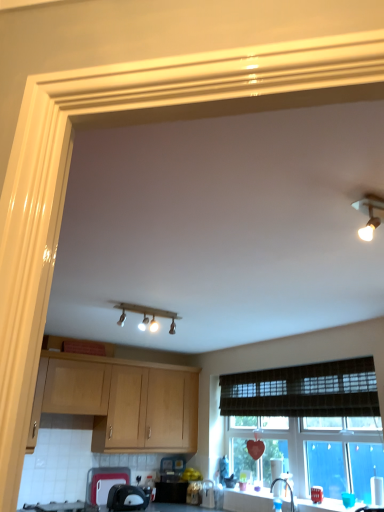
Image resolution: width=384 pixels, height=512 pixels. I want to click on matte plastic cutting board at lower left, acting as the fourth appliance starting from the right, so click(104, 482).

Find the location of a particular element. metallic silver toaster at lower center, which is the first appliance in right-to-left order is located at coordinates (208, 494).

Measure the distance between light wood cabinet at upper left and metallic silver toaster at lower center, the 3th appliance viewed from the left.

They are 38.47 inches apart.

Which of these two, light wood cabinet at upper left or metallic silver toaster at lower center, which is the 2th appliance from right to left, stands shorter?

metallic silver toaster at lower center, which is the 2th appliance from right to left.

Is light wood cabinet at upper left bigger than metallic silver toaster at lower center, the 3th appliance viewed from the left?

Yes.

Looking at their sizes, would you say light wood cabinet at upper left is wider or thinner than metallic silver toaster at lower center, which is the 2th appliance from right to left?

Clearly, light wood cabinet at upper left has more width compared to metallic silver toaster at lower center, which is the 2th appliance from right to left.

Which object is positioned more to the left, matte plastic cutting board at lower left, which is the first appliance from left to right, or matte wood light fixture at upper center?

From the viewer's perspective, matte plastic cutting board at lower left, which is the first appliance from left to right, appears more on the left side.

Which is farther, (93, 495) or (128, 305)?

Point (93, 495)

Considering the sizes of objects matte plastic cutting board at lower left, which is the first appliance from left to right, and matte wood light fixture at upper center in the image provided, who is thinner, matte plastic cutting board at lower left, which is the first appliance from left to right, or matte wood light fixture at upper center?

Thinner between the two is matte plastic cutting board at lower left, which is the first appliance from left to right.

Is matte plastic cutting board at lower left, acting as the fourth appliance starting from the right, not inside matte wood light fixture at upper center?

Yes, matte plastic cutting board at lower left, acting as the fourth appliance starting from the right, is located beyond the bounds of matte wood light fixture at upper center.

How many degrees apart are the facing directions of matte plastic cutting board at lower left, which is the first appliance from left to right, and metallic silver toaster at lower center, the 3th appliance viewed from the left?

85.5 degrees.

Identify the location of the 2nd appliance to the right when counting from the matte plastic cutting board at lower left, acting as the fourth appliance starting from the right. The image size is (384, 512). (194, 493).

Is matte plastic cutting board at lower left, which is the first appliance from left to right, facing towards metallic silver toaster at lower center, which is the 2th appliance from right to left?

No, matte plastic cutting board at lower left, which is the first appliance from left to right, does not turn towards metallic silver toaster at lower center, which is the 2th appliance from right to left.

Is metallic silver toaster at lower center, the 3th appliance viewed from the left, wider than matte wood light fixture at upper center?

No, metallic silver toaster at lower center, the 3th appliance viewed from the left, is not wider than matte wood light fixture at upper center.

Is metallic silver toaster at lower center, which is the 2th appliance from right to left, positioned beyond the bounds of matte wood light fixture at upper center?

Indeed, metallic silver toaster at lower center, which is the 2th appliance from right to left, is completely outside matte wood light fixture at upper center.

Is metallic silver toaster at lower center, which is the 2th appliance from right to left, far away from matte wood light fixture at upper center?

Indeed, metallic silver toaster at lower center, which is the 2th appliance from right to left, is not near matte wood light fixture at upper center.

In terms of height, does metallic silver toaster at lower center, which is the 2th appliance from right to left, look taller or shorter compared to matte wood light fixture at upper center?

Considering their sizes, metallic silver toaster at lower center, which is the 2th appliance from right to left, has more height than matte wood light fixture at upper center.

Considering the points (196, 492) and (265, 494), which point is behind, point (196, 492) or point (265, 494)?

The point (196, 492) is farther.

From the image's perspective, who appears lower, metallic silver toaster at lower center, the 3th appliance viewed from the left, or white glossy countertop at lower center?

metallic silver toaster at lower center, the 3th appliance viewed from the left, appears lower in the image.

Is metallic silver toaster at lower center, which is the 2th appliance from right to left, not near white glossy countertop at lower center?

metallic silver toaster at lower center, which is the 2th appliance from right to left, is near white glossy countertop at lower center, not far away.

Is white glossy countertop at lower center at the back of metallic silver toaster at lower center, the 3th appliance viewed from the left?

No, white glossy countertop at lower center is not at the back of metallic silver toaster at lower center, the 3th appliance viewed from the left.

How much distance is there between satin chrome faucet at lower center and matte wood light fixture at upper center?

satin chrome faucet at lower center is 1.80 meters from matte wood light fixture at upper center.

Do you think satin chrome faucet at lower center is within matte wood light fixture at upper center, or outside of it?

satin chrome faucet at lower center is spatially situated outside matte wood light fixture at upper center.

Is satin chrome faucet at lower center positioned with its back to matte wood light fixture at upper center?

That's not correct — satin chrome faucet at lower center is not looking away from matte wood light fixture at upper center.

Is metallic silver toaster at lower center, which is the 2th appliance from right to left, in front of or behind light wood cabinet at upper left in the image?

metallic silver toaster at lower center, which is the 2th appliance from right to left, is positioned farther from the viewer than light wood cabinet at upper left.

Can you tell me how much metallic silver toaster at lower center, the 3th appliance viewed from the left, and light wood cabinet at upper left differ in facing direction?

metallic silver toaster at lower center, the 3th appliance viewed from the left, and light wood cabinet at upper left are facing 87.8 degrees away from each other.

Which object is wider, metallic silver toaster at lower center, the 3th appliance viewed from the left, or light wood cabinet at upper left?

light wood cabinet at upper left is wider.

The width and height of the screenshot is (384, 512). I want to click on the 4th appliance behind the light wood cabinet at upper left, counting from the anchor's position, so click(194, 493).

Image resolution: width=384 pixels, height=512 pixels. I want to click on cabinetry in front of the metallic silver toaster at lower center, the 3th appliance viewed from the left, so click(x=120, y=402).

Find the location of a particular element. Image resolution: width=384 pixels, height=512 pixels. the 2nd appliance below the matte wood light fixture at upper center (from the image's perspective) is located at coordinates (104, 482).

Looking at the image, which one is located closer to black plastic toaster at lower center, the second appliance in the left-to-right sequence, black glass gas stove at lower left or metallic silver toaster at lower center, the 3th appliance viewed from the left?

Based on the image, black glass gas stove at lower left appears to be nearer to black plastic toaster at lower center, the second appliance in the left-to-right sequence.

Based on the photo, estimate the real-world distances between objects in this image. Which object is further from black glass gas stove at lower left, metallic silver toaster at lower center, the 3th appliance viewed from the left, or matte wood light fixture at upper center?

Based on the image, matte wood light fixture at upper center appears to be further to black glass gas stove at lower left.

Estimate the real-world distances between objects in this image. Which object is closer to metallic silver toaster at lower center, which is the first appliance in right-to-left order, white glossy countertop at lower center or light wood cabinet at upper left?

white glossy countertop at lower center is positioned closer to the anchor metallic silver toaster at lower center, which is the first appliance in right-to-left order.

Which object lies further to the anchor point satin chrome faucet at lower center, brown woven curtain at lower center or black plastic toaster at lower center, which is counted as the third appliance, starting from the right?

black plastic toaster at lower center, which is counted as the third appliance, starting from the right, is further to satin chrome faucet at lower center.

From the image, which object appears to be nearer to matte plastic cutting board at lower left, acting as the fourth appliance starting from the right, white glossy countertop at lower center or black glass gas stove at lower left?

Among the two, black glass gas stove at lower left is located nearer to matte plastic cutting board at lower left, acting as the fourth appliance starting from the right.

Based on their spatial positions, is light wood cabinet at upper left or matte plastic cutting board at lower left, acting as the fourth appliance starting from the right, further from brown woven curtain at lower center?

matte plastic cutting board at lower left, acting as the fourth appliance starting from the right, is further to brown woven curtain at lower center.

From the image, which object appears to be farther from metallic silver toaster at lower center, which is the 2th appliance from right to left, black glass gas stove at lower left or matte plastic cutting board at lower left, acting as the fourth appliance starting from the right?

The object further to metallic silver toaster at lower center, which is the 2th appliance from right to left, is black glass gas stove at lower left.

From the image, which object appears to be farther from light wood cabinet at upper left, black glass gas stove at lower left or black plastic toaster at lower center, the second appliance in the left-to-right sequence?

Based on the image, black glass gas stove at lower left appears to be further to light wood cabinet at upper left.

The image size is (384, 512). Find the location of `counter top between matte wood light fixture at upper center and metallic silver toaster at lower center, the 3th appliance viewed from the left, vertically`. counter top between matte wood light fixture at upper center and metallic silver toaster at lower center, the 3th appliance viewed from the left, vertically is located at coordinates (248, 500).

Locate an element on the screen. Image resolution: width=384 pixels, height=512 pixels. counter top between black plastic toaster at lower center, which is counted as the third appliance, starting from the right, and satin chrome faucet at lower center, in the horizontal direction is located at coordinates (248, 500).

Locate an element on the screen. The height and width of the screenshot is (512, 384). faucet between matte wood light fixture at upper center and matte plastic cutting board at lower left, acting as the fourth appliance starting from the right, in the up-down direction is located at coordinates (286, 486).

This screenshot has width=384, height=512. What are the coordinates of `appliance between matte wood light fixture at upper center and matte plastic cutting board at lower left, acting as the fourth appliance starting from the right, in the vertical direction` in the screenshot? It's located at (127, 498).